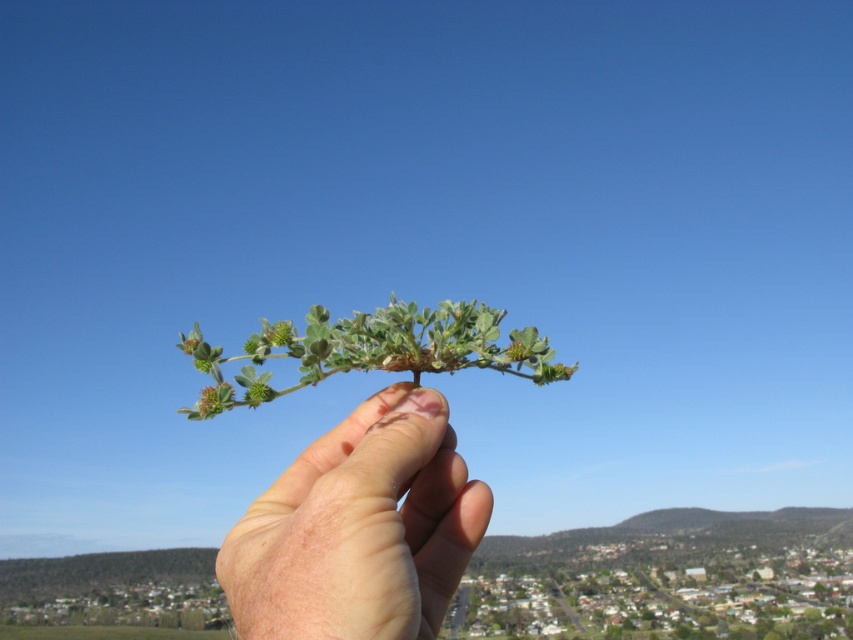
You are a photographer trying to capture a detailed closeup of the plant in the hand. The camera you are using has a depth of field that can focus clearly up to 18 inches. Based on the scene, will the point at point (334, 589) be within the camera focus range?

The distance of point (334, 589) from camera is 17.34 inches, which is within the camera focus range of up to 18 inches. Therefore, the point will be in focus.